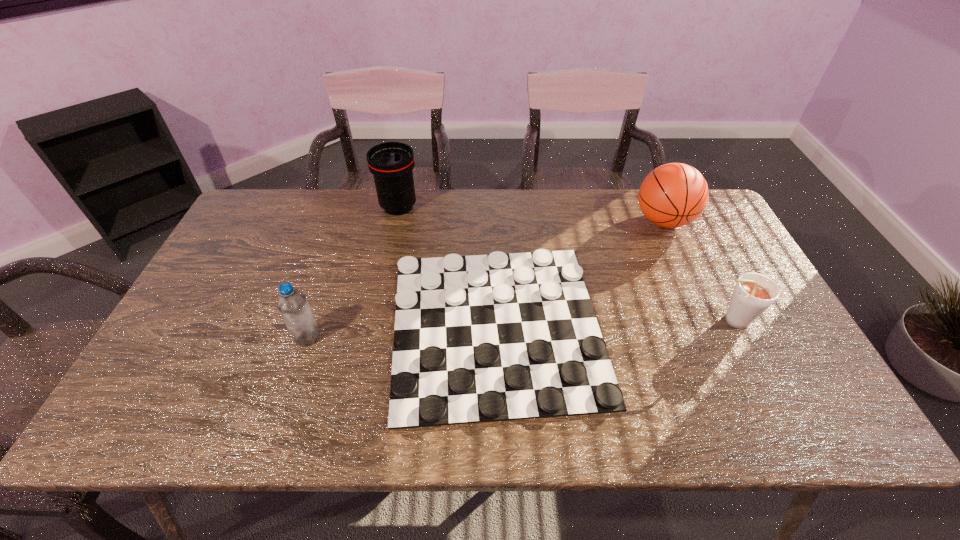
Image resolution: width=960 pixels, height=540 pixels. Find the location of `telephoto lens`. telephoto lens is located at coordinates (391, 163).

Find the location of a particular element. basketball is located at coordinates (673, 195).

Identify the location of water bottle. (292, 304).

You are a GUI agent. You are given a task and a screenshot of the screen. Output one action in this format:
    pyautogui.click(x=<x>, y=<y>)
    Task: Click on the root beer
    This screenshot has width=960, height=540.
    Given the screenshot: What is the action you would take?
    pyautogui.click(x=754, y=293)

You are a GUI agent. You are given a task and a screenshot of the screen. Output one action in this format:
    pyautogui.click(x=<x>, y=<y>)
    Task: Click on the gameboard
    The image size is (960, 540).
    Given the screenshot: What is the action you would take?
    pyautogui.click(x=484, y=338)

This screenshot has height=540, width=960. Find the location of `free spot located on the right of the telephoto lens`. free spot located on the right of the telephoto lens is located at coordinates (480, 207).

I want to click on vacant area situated on the left of the basketball, so click(x=580, y=221).

Locate an element on the screen. The width and height of the screenshot is (960, 540). free space located 0.330m on the back of the water bottle is located at coordinates (340, 241).

In order to click on vacant area located on the drink side of the root beer in this screenshot , I will do `click(681, 320)`.

The height and width of the screenshot is (540, 960). Identify the location of free space located 0.210m on the drink side of the root beer. (626, 320).